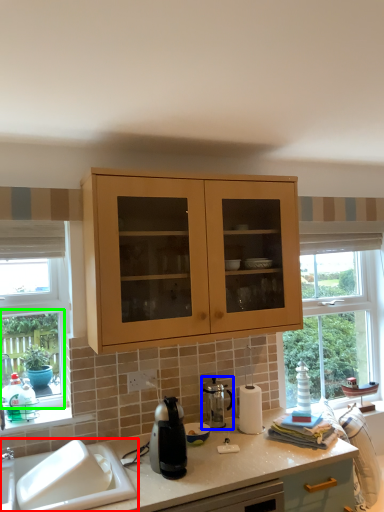
Question: Which is nearer to the sink (highlighted by a red box)? appliance (highlighted by a blue box) or window frame (highlighted by a green box).

Choices:
 (A) appliance
 (B) window frame

Answer: (B)